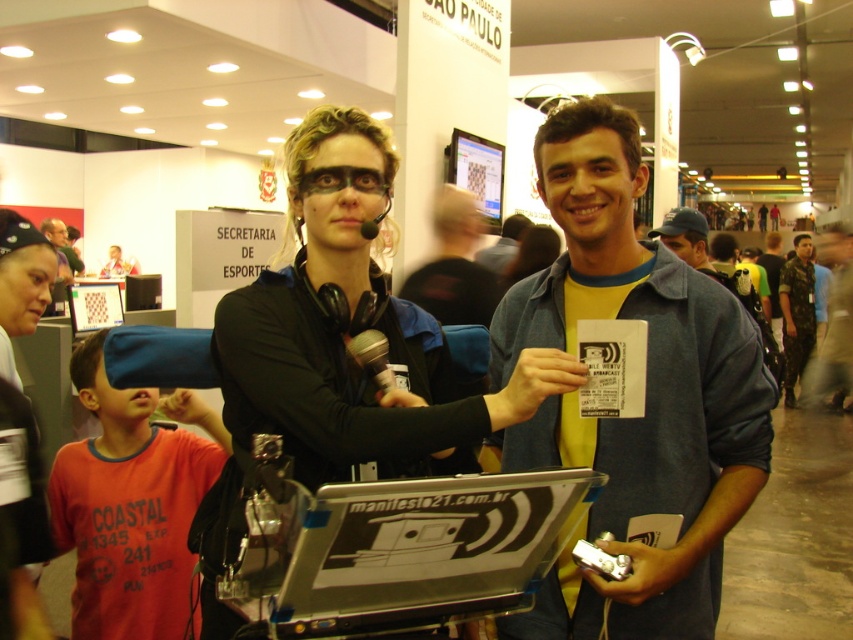
Question: Among these points, which one is nearest to the camera?

Choices:
 (A) (729, 440)
 (B) (457, 209)
 (C) (403, 438)
 (D) (796, 368)

Answer: (C)

Question: Which object is farther from the camera taking this photo?

Choices:
 (A) silver metallic microphone at center
 (B) blue denim jacket at center

Answer: (B)

Question: Is the position of camouflage fabric shirt at right less distant than that of silver metallic microphone at center?

Choices:
 (A) yes
 (B) no

Answer: (B)

Question: Among these objects, which one is farthest from the camera?

Choices:
 (A) red t-shirt at center
 (B) denim jacket at center

Answer: (A)

Question: Is camouflage fabric shirt at right bigger than silver metallic microphone at center?

Choices:
 (A) yes
 (B) no

Answer: (A)

Question: Is blue denim shirt at center positioned before blue denim jacket at center?

Choices:
 (A) yes
 (B) no

Answer: (A)